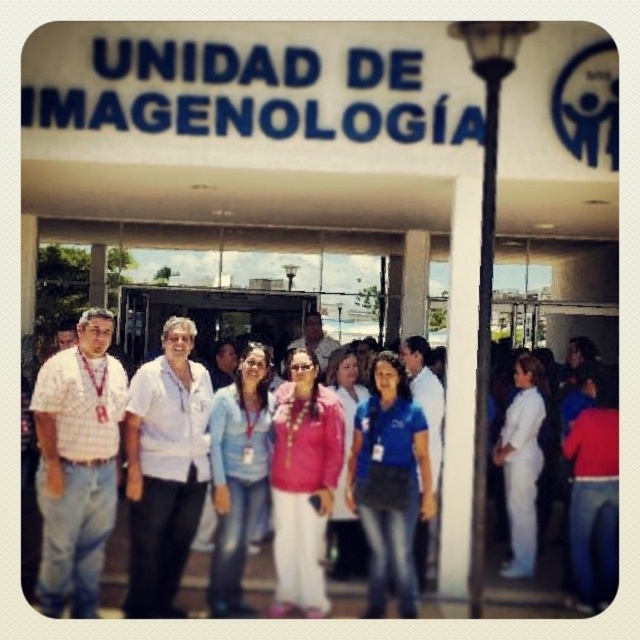
Question: Does white matte shirt at center have a greater width compared to blue jeans at center?

Choices:
 (A) yes
 (B) no

Answer: (A)

Question: Does white matte shirt at center appear on the right side of blue jeans at center?

Choices:
 (A) no
 (B) yes

Answer: (A)

Question: Which point is farther to the camera?

Choices:
 (A) (538, 449)
 (B) (48, 604)
 (C) (236, 561)
 (D) (138, 534)

Answer: (A)

Question: Which of these objects is positioned closest to the white checkered shirt at left?

Choices:
 (A) white matte shirt at center
 (B) pink matte shirt at center
 (C) blue denim shirt at center
 (D) blue jeans at center

Answer: (A)

Question: Does blue denim shirt at center lie in front of blue jeans at center?

Choices:
 (A) no
 (B) yes

Answer: (B)

Question: Which of the following is the farthest from the observer?

Choices:
 (A) pink matte shirt at center
 (B) blue denim shirt at center
 (C) white checkered shirt at left

Answer: (A)